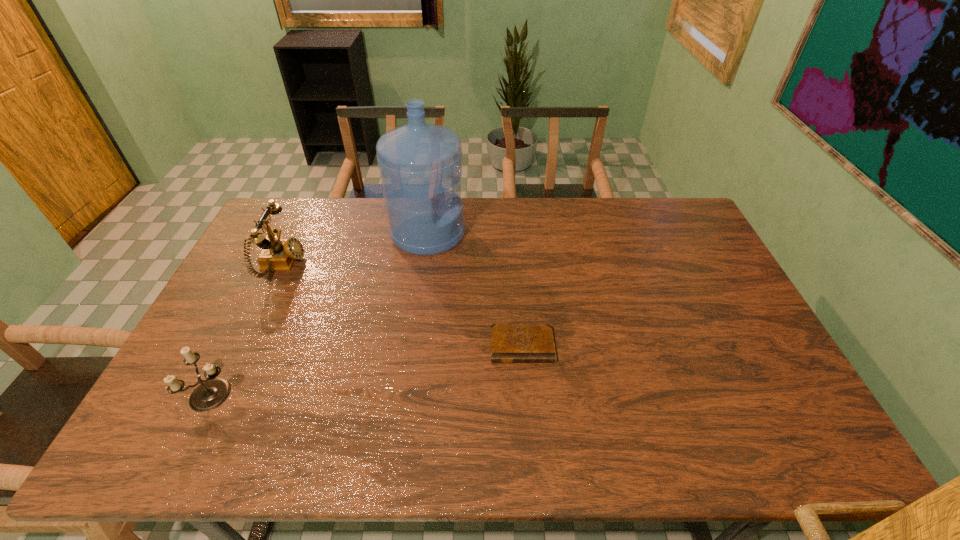
Locate an element on the screen. The width and height of the screenshot is (960, 540). the third object from left to right is located at coordinates (419, 162).

Image resolution: width=960 pixels, height=540 pixels. Find the location of `water jug`. water jug is located at coordinates (419, 162).

Where is `the second tallest object`? The image size is (960, 540). the second tallest object is located at coordinates (278, 254).

You are a GUI agent. You are given a task and a screenshot of the screen. Output one action in this format:
    pyautogui.click(x=<x>, y=<y>)
    Task: Click on the nearest object
    
    Given the screenshot: What is the action you would take?
    pyautogui.click(x=211, y=393)

Where is `candle holder`? candle holder is located at coordinates (211, 393).

Find the location of a particular element. diary is located at coordinates (510, 343).

You are a GUI agent. You are given a task and a screenshot of the screen. Output one action in this format:
    pyautogui.click(x=<x>, y=<y>)
    Task: Click on the shortest object
    The width and height of the screenshot is (960, 540).
    Given the screenshot: What is the action you would take?
    pyautogui.click(x=510, y=343)

Where is `free space located on the side of the water jug with the handle`? Image resolution: width=960 pixels, height=540 pixels. free space located on the side of the water jug with the handle is located at coordinates (488, 233).

This screenshot has width=960, height=540. What are the coordinates of `vacant space located 0.360m on the dial number of the telephone` in the screenshot? It's located at (412, 265).

Where is `vacant area situated on the back of the nearest object`? vacant area situated on the back of the nearest object is located at coordinates (266, 288).